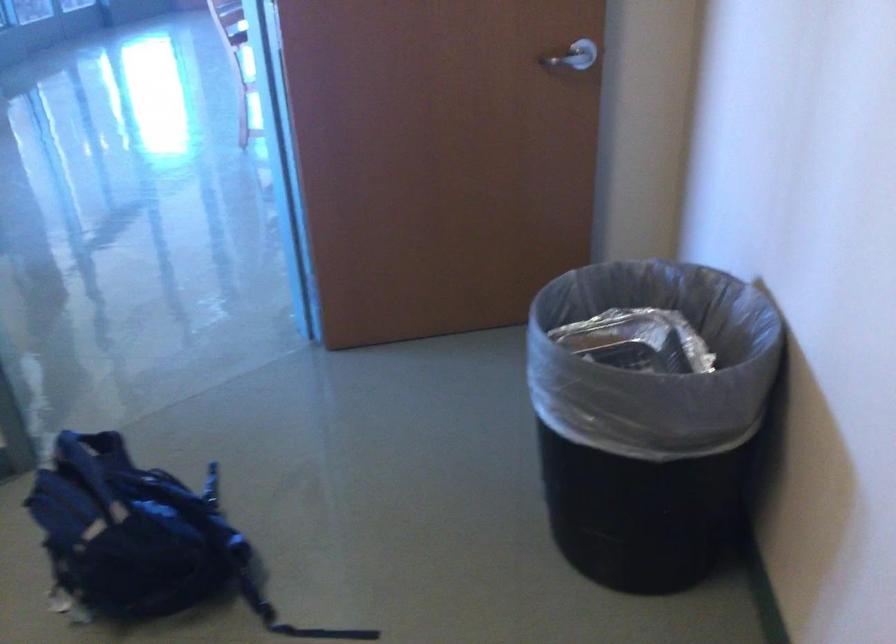
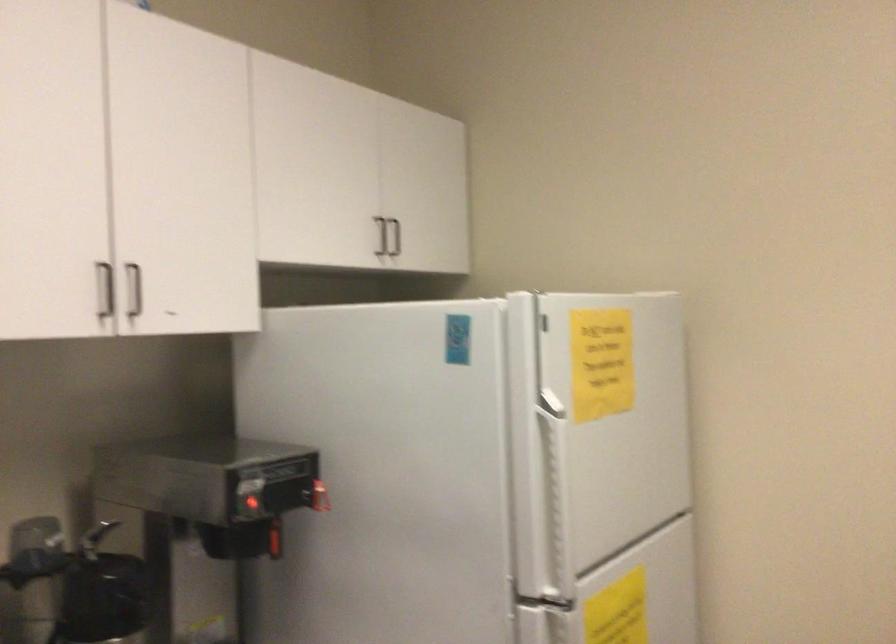
Question: Based on the continuous images, in which direction is the camera rotating? Reply with the corresponding letter.

Choices:
 (A) Left
 (B) Right
 (C) Up
 (D) Down

Answer: (A)